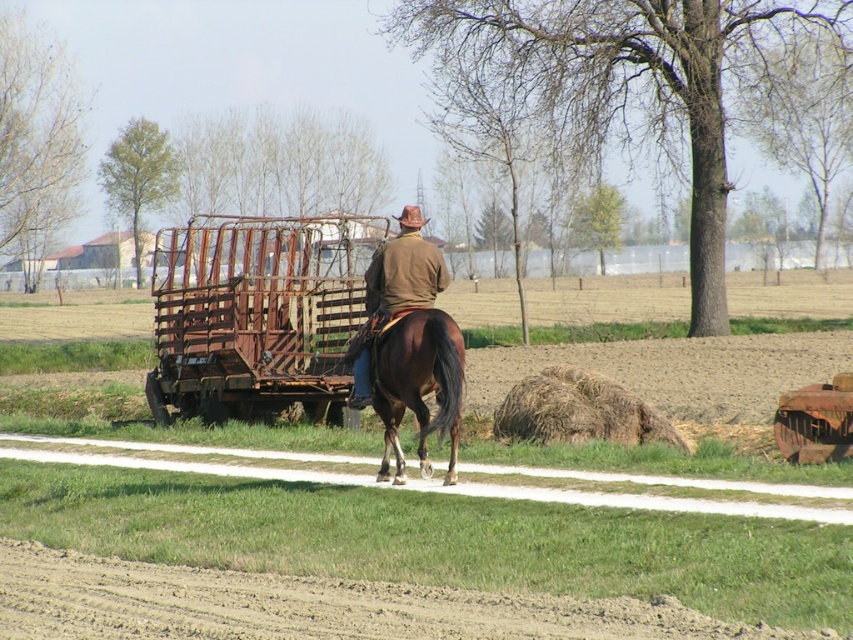
Can you confirm if dusty brown dirt track at lower left is wider than brown leather jacket at center?

Indeed, dusty brown dirt track at lower left has a greater width compared to brown leather jacket at center.

Is dusty brown dirt track at lower left taller than brown leather jacket at center?

Incorrect, dusty brown dirt track at lower left's height is not larger of brown leather jacket at center's.

Who is more forward, (184,625) or (361,353)?

Positioned in front is point (184,625).

I want to click on dusty brown dirt track at lower left, so click(x=312, y=605).

Between dusty brown dirt track at lower left and brown glossy horse at center, which one is positioned higher?

brown glossy horse at center

Consider the image. Does dusty brown dirt track at lower left have a greater width compared to brown glossy horse at center?

Yes, dusty brown dirt track at lower left is wider than brown glossy horse at center.

Where is `dusty brown dirt track at lower left`? dusty brown dirt track at lower left is located at coordinates (312, 605).

Can you confirm if brown glossy horse at center is thinner than brown straw bale at right?

Answer: Indeed, brown glossy horse at center has a lesser width compared to brown straw bale at right.

Between brown glossy horse at center and brown straw bale at right, which one appears on the left side from the viewer's perspective?

Positioned to the left is brown glossy horse at center.

The image size is (853, 640). What do you see at coordinates (416, 385) in the screenshot? I see `brown glossy horse at center` at bounding box center [416, 385].

Where is `brown glossy horse at center`? brown glossy horse at center is located at coordinates (416, 385).